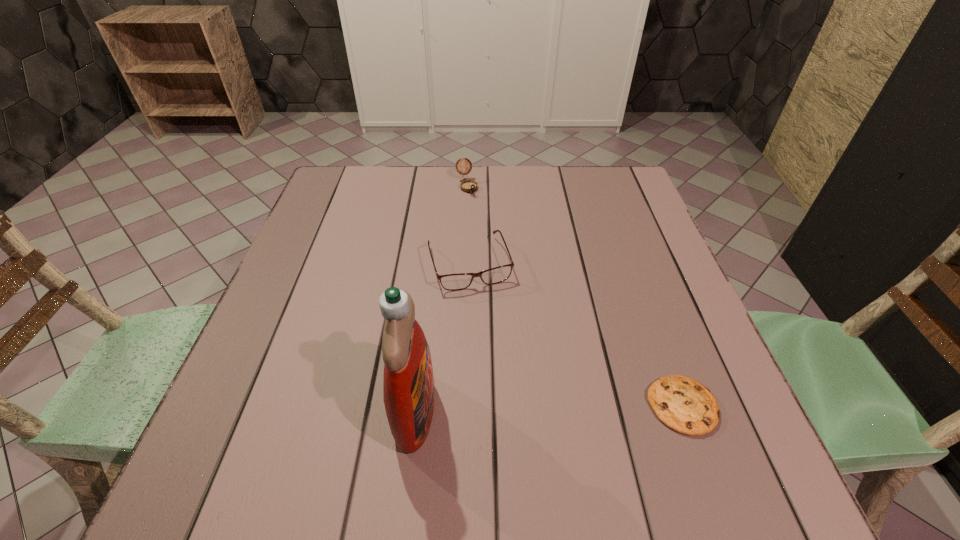
The image size is (960, 540). Identify the location of vacant area situated on the face of the second tallest object. (492, 242).

In order to click on free region located 0.360m on the face of the second tallest object in this screenshot , I will do `click(513, 282)`.

Find the location of a particular element. vacant space located on the lenses of the spectacles is located at coordinates (510, 381).

Image resolution: width=960 pixels, height=540 pixels. I want to click on free point located 0.210m on the lenses of the spectacles, so click(x=505, y=368).

The width and height of the screenshot is (960, 540). I want to click on free space located 0.290m on the lenses of the spectacles, so click(x=517, y=405).

In order to click on object present at the far edge in this screenshot , I will do `click(469, 186)`.

Locate an element on the screen. The height and width of the screenshot is (540, 960). detergent that is at the near edge is located at coordinates pyautogui.click(x=408, y=384).

You are a GUI agent. You are given a task and a screenshot of the screen. Output one action in this format:
    pyautogui.click(x=<x>, y=<y>)
    Task: Click on the cookie at the near edge
    
    Given the screenshot: What is the action you would take?
    pyautogui.click(x=683, y=404)

Locate an element on the screen. object present at the right edge is located at coordinates (683, 404).

The image size is (960, 540). In order to click on object at the near right corner in this screenshot , I will do `click(683, 404)`.